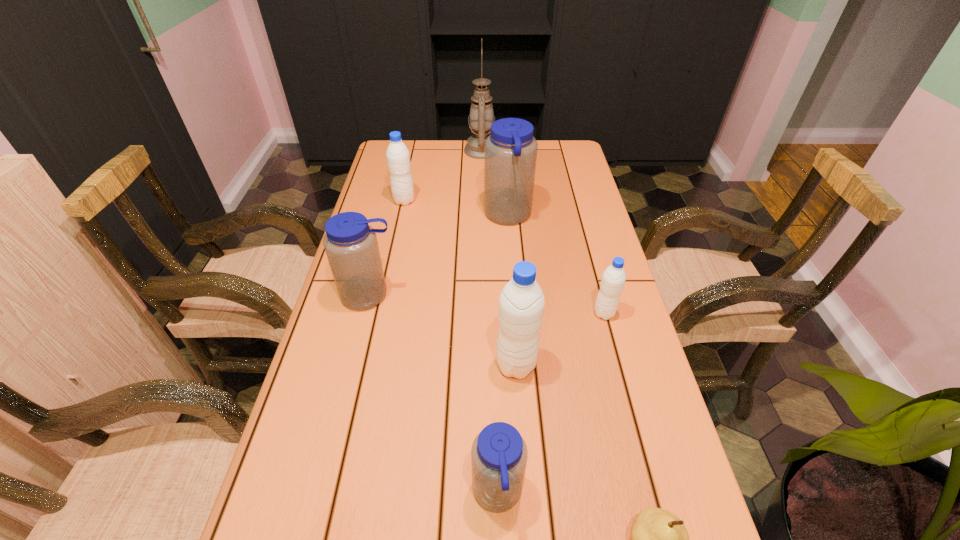
Where is `unoccupied position between the second biggest blue water bottle and the rightmost water bottle`? The width and height of the screenshot is (960, 540). unoccupied position between the second biggest blue water bottle and the rightmost water bottle is located at coordinates (487, 304).

This screenshot has height=540, width=960. In order to click on vacant area between the farthest blue water bottle and the rightmost water bottle in this screenshot , I will do `click(556, 265)`.

Locate an element on the screen. free space between the biggest gray water bottle and the tallest object is located at coordinates (499, 258).

Identify the location of unoccupied area between the second farthest gray water bottle and the farthest object. (542, 232).

The height and width of the screenshot is (540, 960). What are the coordinates of `empty location between the farthest blue water bottle and the leftmost blue water bottle` in the screenshot? It's located at (439, 255).

Locate an element on the screen. unoccupied area between the biggest gray water bottle and the second biggest blue water bottle is located at coordinates (443, 330).

Find the location of a particular element. This screenshot has width=960, height=540. vacant space in between the leftmost gray water bottle and the gray oil lamp is located at coordinates (443, 176).

At what (x,y) coordinates should I click in order to perform the action: click on object that is the third closest to the second smallest blue water bottle. Please return your answer as a coordinate pair (x, y). The image size is (960, 540). Looking at the image, I should click on (398, 157).

I want to click on the third closest object to the pear, so click(613, 279).

Identify which water bottle is the nearest to the rightmost water bottle. Please provide its 2D coordinates. Your answer should be formatted as a tuple, i.e. [(x, y)], where the tuple contains the x and y coordinates of a point satisfying the conditions above.

[(521, 303)]